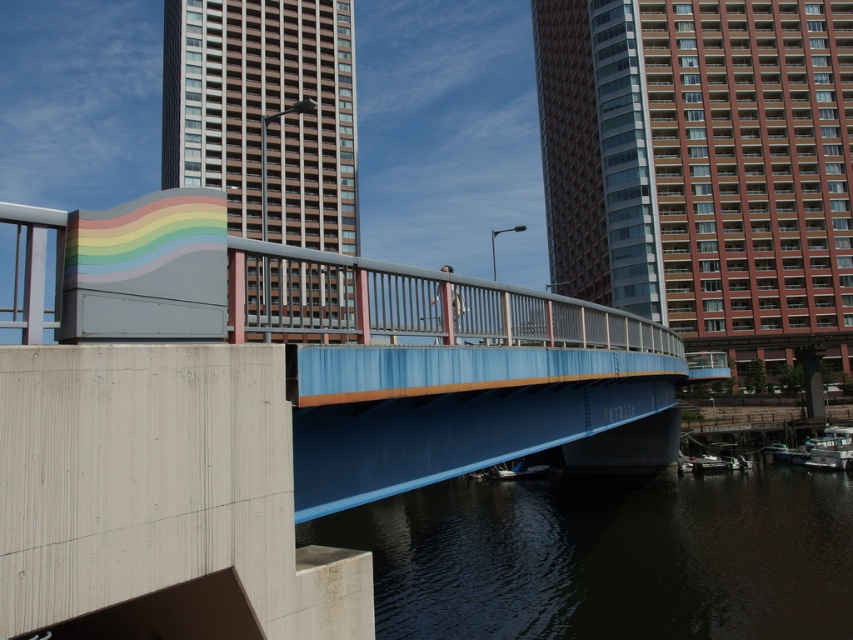
You are a city planner analyzing the urban layout. Given the scene, which object occupies a larger area in the image between the dark water at lower center and the matte gray building at center?

The matte gray building at center occupies a larger area in the image than the dark water at lower center, as the dark water at lower center has a smaller size compared to the matte gray building at center.

You are a drone operator who needs to fly a drone from the brick textured building at upper right to the dark water at lower center. What is the approximate distance you need to cover?

The distance between the brick textured building at upper right and the dark water at lower center is 155.78 feet, so the drone operator needs to cover approximately 155.78 feet.